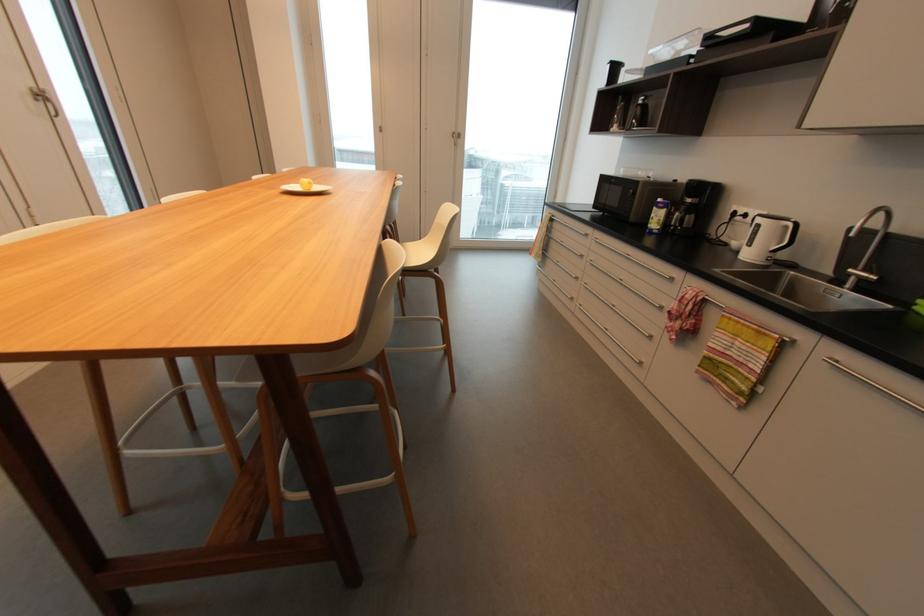
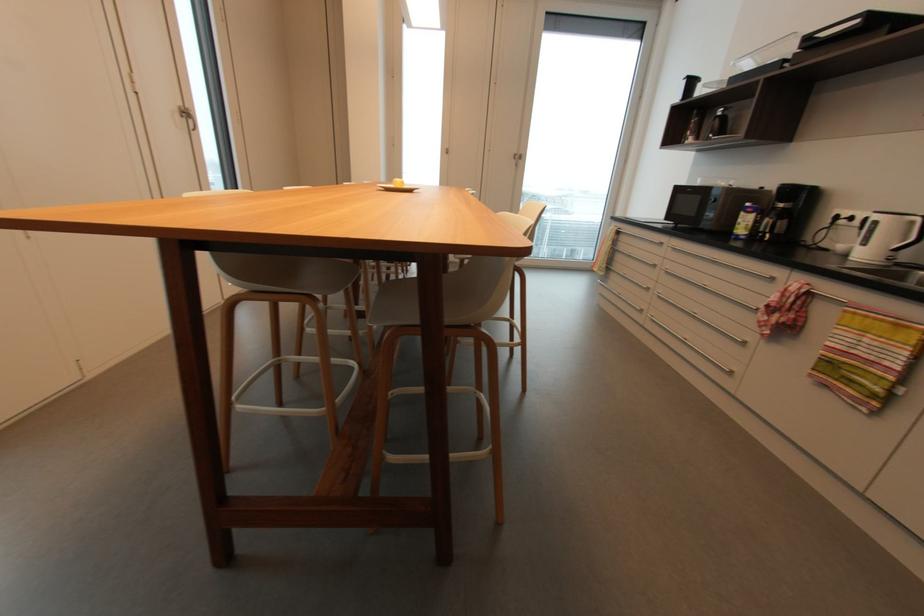
Where in the second image is the point corresponding to point 789,227 from the first image?

(916, 223)